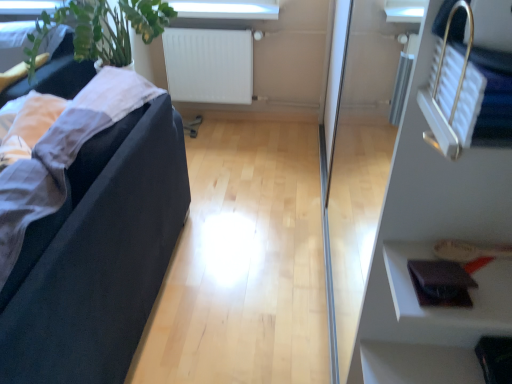
Question: Considering the relative sizes of transparent glass door at right and white matte radiator at upper center in the image provided, is transparent glass door at right wider than white matte radiator at upper center?

Choices:
 (A) no
 (B) yes

Answer: (A)

Question: Can you confirm if transparent glass door at right is bigger than white matte radiator at upper center?

Choices:
 (A) no
 (B) yes

Answer: (B)

Question: Can you confirm if transparent glass door at right is shorter than white matte radiator at upper center?

Choices:
 (A) yes
 (B) no

Answer: (B)

Question: From a real-world perspective, is transparent glass door at right below white matte radiator at upper center?

Choices:
 (A) yes
 (B) no

Answer: (B)

Question: From the image's perspective, is transparent glass door at right over white matte radiator at upper center?

Choices:
 (A) no
 (B) yes

Answer: (A)

Question: Considering the positions of white matte radiator at upper center and transparent glass door at right in the image, is white matte radiator at upper center wider or thinner than transparent glass door at right?

Choices:
 (A) thin
 (B) wide

Answer: (B)

Question: Considering their positions, is white matte radiator at upper center located in front of or behind transparent glass door at right?

Choices:
 (A) front
 (B) behind

Answer: (B)

Question: Is point (175, 89) closer or farther from the camera than point (342, 107)?

Choices:
 (A) farther
 (B) closer

Answer: (B)

Question: From a real-world perspective, relative to transparent glass door at right, is white matte radiator at upper center vertically above or below?

Choices:
 (A) below
 (B) above

Answer: (A)

Question: In terms of height, does black fabric couch at left look taller or shorter compared to white matte radiator at upper center?

Choices:
 (A) short
 (B) tall

Answer: (B)

Question: Is point (138, 291) positioned closer to the camera than point (175, 86)?

Choices:
 (A) closer
 (B) farther

Answer: (A)

Question: Based on their positions, is black fabric couch at left located to the left or right of white matte radiator at upper center?

Choices:
 (A) left
 (B) right

Answer: (A)

Question: Is black fabric couch at left inside the boundaries of white matte radiator at upper center, or outside?

Choices:
 (A) inside
 (B) outside

Answer: (B)

Question: Is leather wallet at lower right wider or thinner than transparent glass door at right?

Choices:
 (A) wide
 (B) thin

Answer: (A)

Question: Is leather wallet at lower right to the left or to the right of transparent glass door at right in the image?

Choices:
 (A) right
 (B) left

Answer: (A)